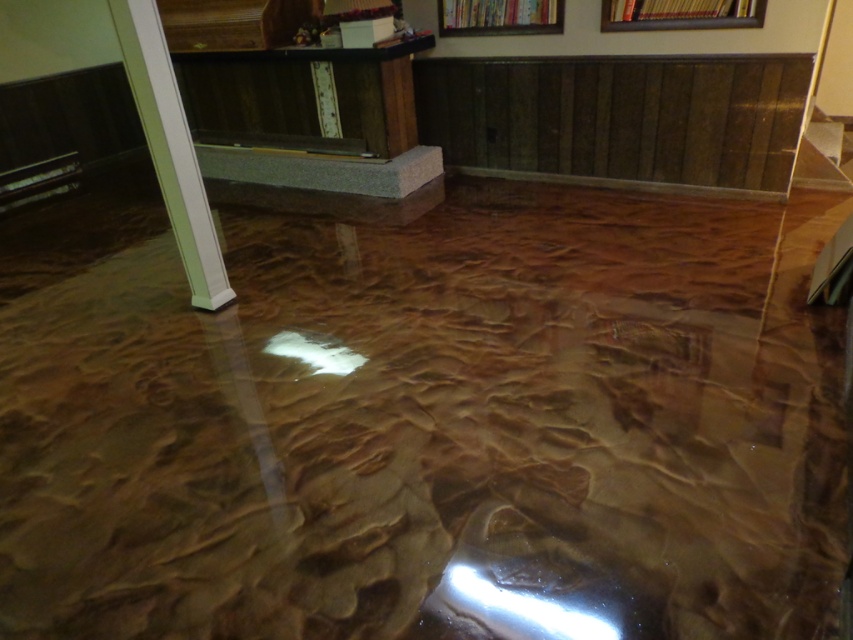
Is point (128, 74) closer to camera compared to point (688, 8)?

That is True.

Does white glossy pillar at left have a lesser width compared to wooden picture frame at upper center?

Yes, white glossy pillar at left is thinner than wooden picture frame at upper center.

Does point (142, 8) come closer to viewer compared to point (697, 19)?

Yes, point (142, 8) is closer to viewer.

At what (x,y) coordinates should I click in order to perform the action: click on white glossy pillar at left. Please return your answer as a coordinate pair (x, y). The image size is (853, 640). Looking at the image, I should click on (170, 148).

Based on the photo, is wooden picture frame at upper center in front of metallic gold picture frame at upper center?

Yes.

Who is more forward, (685, 4) or (518, 19)?

Point (685, 4) is in front.

Describe the element at coordinates (680, 13) in the screenshot. I see `wooden picture frame at upper center` at that location.

This screenshot has height=640, width=853. I want to click on wooden picture frame at upper center, so click(x=680, y=13).

From the picture: Who is positioned more to the left, white glossy pillar at left or metallic gold picture frame at upper center?

white glossy pillar at left

Does white glossy pillar at left appear on the right side of metallic gold picture frame at upper center?

Incorrect, white glossy pillar at left is not on the right side of metallic gold picture frame at upper center.

Describe the element at coordinates (170, 148) in the screenshot. I see `white glossy pillar at left` at that location.

In order to click on white glossy pillar at left in this screenshot , I will do `click(170, 148)`.